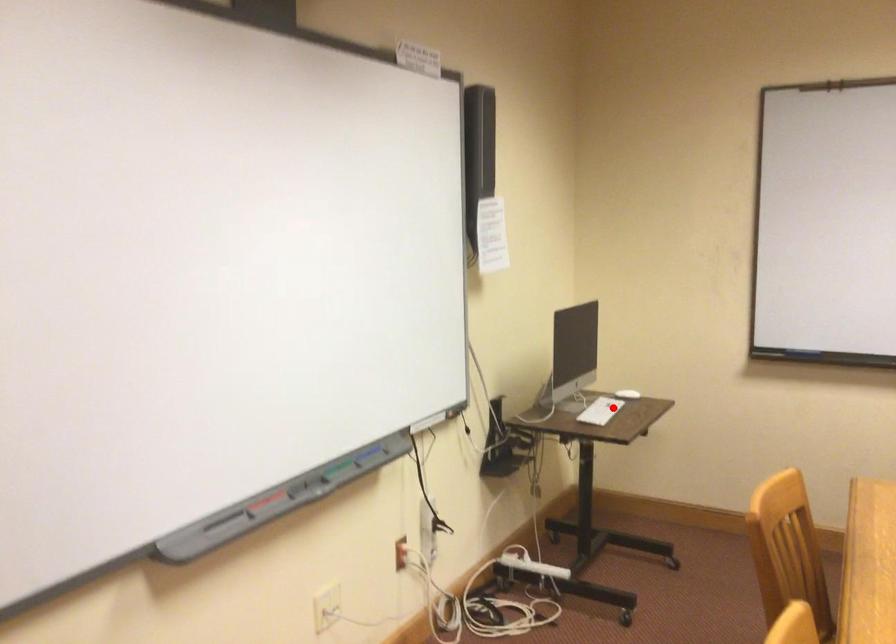
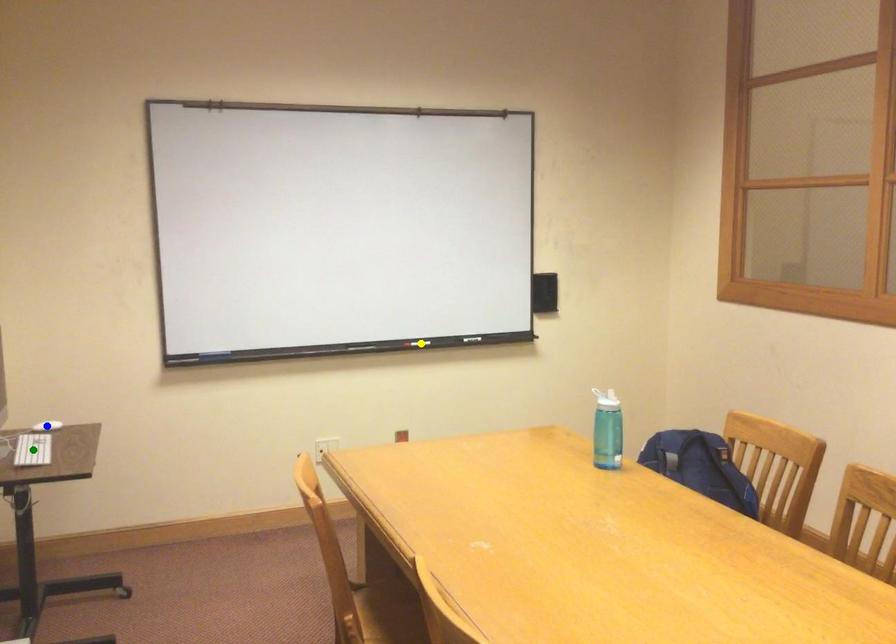
Question: I am providing you with two images of the same scene from different viewpoints. A red point is marked on the first image. You are given multiple points on the second image. Which mark in image 2 goes with the point in image 1?

Choices:
 (A) yellow point
 (B) blue point
 (C) green point

Answer: (C)